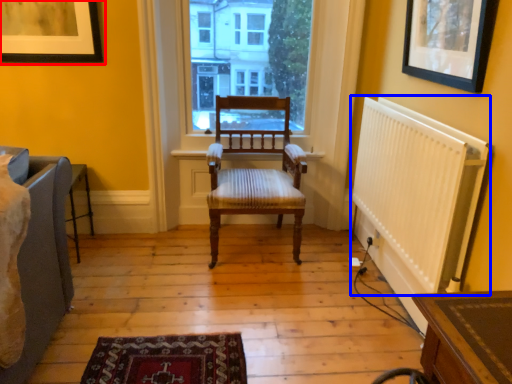
Question: Among these objects, which one is farthest to the camera, picture frame (highlighted by a red box) or radiator (highlighted by a blue box)?

Choices:
 (A) picture frame
 (B) radiator

Answer: (A)